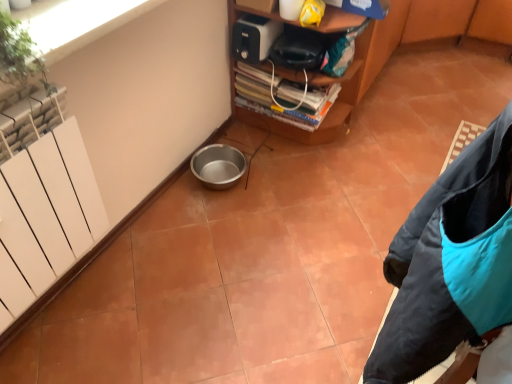
Question: Does teal synthetic jacket at lower right lie behind metallic silver bowl at lower left?

Choices:
 (A) yes
 (B) no

Answer: (B)

Question: From the image's perspective, is teal synthetic jacket at lower right below metallic silver bowl at lower left?

Choices:
 (A) no
 (B) yes

Answer: (B)

Question: Is teal synthetic jacket at lower right thinner than metallic silver bowl at lower left?

Choices:
 (A) yes
 (B) no

Answer: (A)

Question: Could you tell me if teal synthetic jacket at lower right is turned towards metallic silver bowl at lower left?

Choices:
 (A) no
 (B) yes

Answer: (A)

Question: Is teal synthetic jacket at lower right wider than metallic silver bowl at lower left?

Choices:
 (A) yes
 (B) no

Answer: (B)

Question: Is white matte radiator at left inside or outside of teal synthetic jacket at lower right?

Choices:
 (A) inside
 (B) outside

Answer: (B)

Question: In terms of height, does white matte radiator at left look taller or shorter compared to teal synthetic jacket at lower right?

Choices:
 (A) short
 (B) tall

Answer: (A)

Question: Considering the positions of white matte radiator at left and teal synthetic jacket at lower right in the image, is white matte radiator at left wider or thinner than teal synthetic jacket at lower right?

Choices:
 (A) wide
 (B) thin

Answer: (B)

Question: From a real-world perspective, relative to teal synthetic jacket at lower right, is white matte radiator at left vertically above or below?

Choices:
 (A) above
 (B) below

Answer: (B)

Question: Would you say teal synthetic jacket at lower right is inside or outside metallic silver bowl at lower left?

Choices:
 (A) inside
 (B) outside

Answer: (B)

Question: From a real-world perspective, is teal synthetic jacket at lower right physically located above or below metallic silver bowl at lower left?

Choices:
 (A) above
 (B) below

Answer: (A)

Question: Considering the positions of teal synthetic jacket at lower right and metallic silver bowl at lower left in the image, is teal synthetic jacket at lower right taller or shorter than metallic silver bowl at lower left?

Choices:
 (A) tall
 (B) short

Answer: (A)

Question: Based on their positions, is teal synthetic jacket at lower right located to the left or right of metallic silver bowl at lower left?

Choices:
 (A) right
 (B) left

Answer: (A)

Question: Is metallic silver bowl at lower left situated inside teal synthetic jacket at lower right or outside?

Choices:
 (A) inside
 (B) outside

Answer: (B)

Question: From a real-world perspective, is metallic silver bowl at lower left above or below teal synthetic jacket at lower right?

Choices:
 (A) below
 (B) above

Answer: (A)